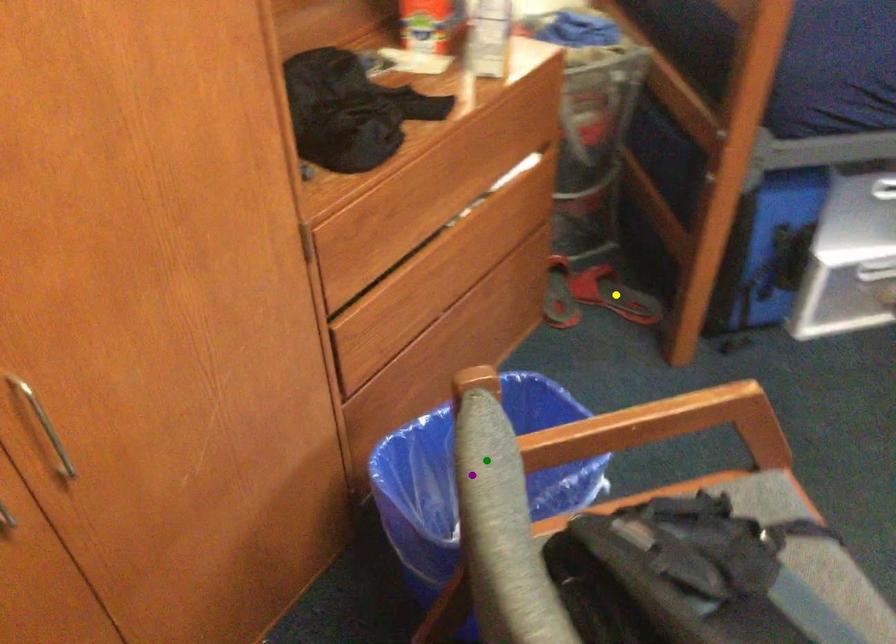
Order these from nearest to farthest:
A) green point
B) purple point
C) yellow point

green point
purple point
yellow point